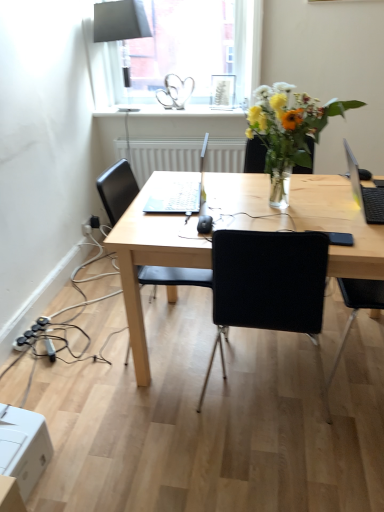
The width and height of the screenshot is (384, 512). Find the location of `vacant space situated on the left part of black plastic mouse at center`. vacant space situated on the left part of black plastic mouse at center is located at coordinates (170, 225).